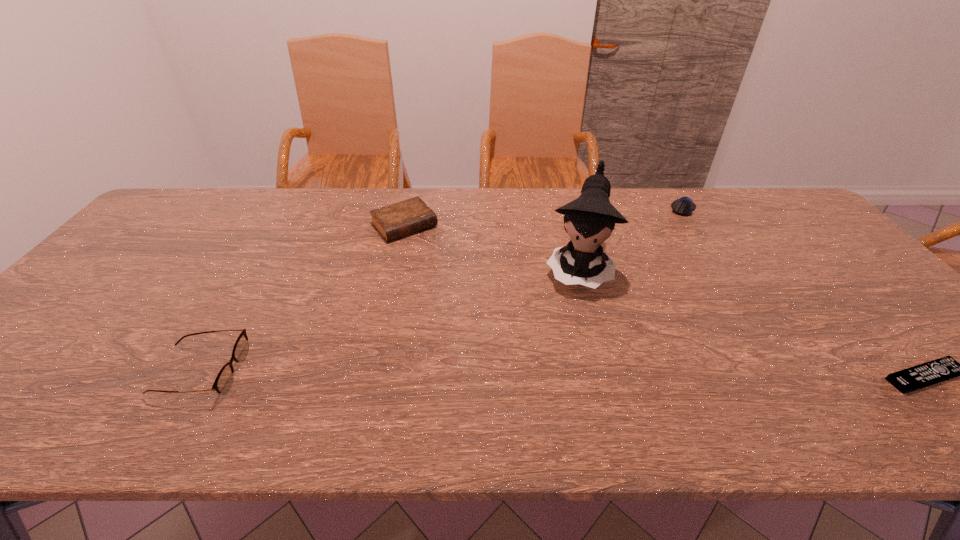
Where is `free space on the desktop that is between the second tallest object and the remote control and is positioned on the spine side of the diary`? The height and width of the screenshot is (540, 960). free space on the desktop that is between the second tallest object and the remote control and is positioned on the spine side of the diary is located at coordinates (536, 374).

At what (x,y) coordinates should I click in order to perform the action: click on free space on the desktop that is between the fourth shortest object and the shortest object and is positioned on the button side of the computer mouse. Please return your answer as a coordinate pair (x, y). The width and height of the screenshot is (960, 540). Looking at the image, I should click on (587, 374).

Image resolution: width=960 pixels, height=540 pixels. Identify the location of free space on the desktop that is between the fourth shortest object and the rightmost object and is positioned at the face of the third object from right to left. pos(555,374).